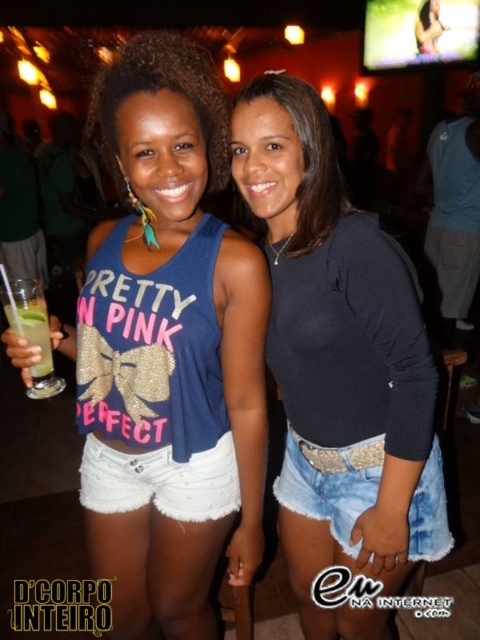
Question: Which object is the closest to the matte blue tank top at center?

Choices:
 (A) white denim shorts at lower center
 (B) black matte shirt at center

Answer: (A)

Question: Which of the following is the farthest from the observer?

Choices:
 (A) white denim shorts at lower center
 (B) matte blue tank top at center
 (C) matte black tank top at upper center
 (D) denim shorts at lower right

Answer: (A)

Question: Which of the following is the farthest from the observer?

Choices:
 (A) denim shorts at lower right
 (B) white denim shorts at lower center
 (C) green translucent glass at left
 (D) matte black tank top at upper center

Answer: (B)

Question: Where is denim shorts at lower right located in relation to white denim shorts at lower center in the image?

Choices:
 (A) below
 (B) above

Answer: (A)

Question: Considering the relative positions of denim shorts at lower right and white denim shorts at lower center in the image provided, where is denim shorts at lower right located with respect to white denim shorts at lower center?

Choices:
 (A) left
 (B) right

Answer: (B)

Question: Can you confirm if black matte shirt at center is positioned below denim shorts at lower right?

Choices:
 (A) no
 (B) yes

Answer: (A)